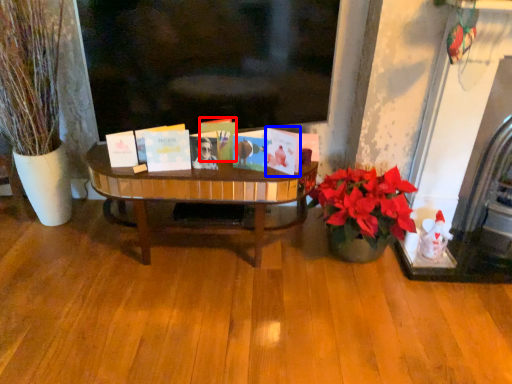
Question: Which of the following is the farthest to the observer, book (highlighted by a red box) or book (highlighted by a blue box)?

Choices:
 (A) book
 (B) book

Answer: (A)